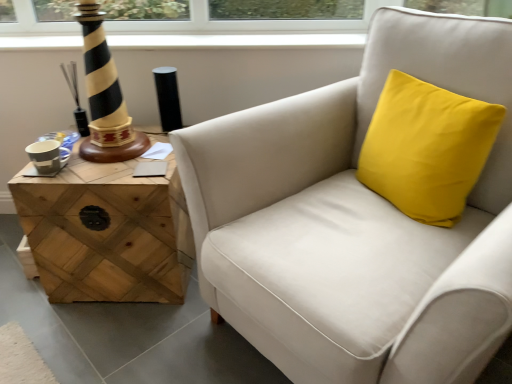
The width and height of the screenshot is (512, 384). Describe the element at coordinates (106, 233) in the screenshot. I see `woodenmaterial/texturetable at left` at that location.

The height and width of the screenshot is (384, 512). In order to click on woodenmaterial/texturetable at left in this screenshot , I will do `click(106, 233)`.

Can matte white armchair at center be found inside woodenmaterial/texturetable at left?

Actually, matte white armchair at center is outside woodenmaterial/texturetable at left.

From the image's perspective, which is below, woodenmaterial/texturetable at left or matte white armchair at center?

woodenmaterial/texturetable at left appears lower in the image.

Is woodenmaterial/texturetable at left looking in the opposite direction of matte white armchair at center?

That's not correct — woodenmaterial/texturetable at left is not looking away from matte white armchair at center.

Considering the positions of objects woodenmaterial/texturetable at left and matte white armchair at center in the image provided, who is more to the right, woodenmaterial/texturetable at left or matte white armchair at center?

matte white armchair at center.

Which object is further away from the camera, yellow fabric cushion at upper right or woodenmaterial/texturetable at left?

Positioned behind is woodenmaterial/texturetable at left.

Does yellow fabric cushion at upper right have a lesser width compared to woodenmaterial/texturetable at left?

Correct, the width of yellow fabric cushion at upper right is less than that of woodenmaterial/texturetable at left.

Could you tell me if yellow fabric cushion at upper right is facing woodenmaterial/texturetable at left?

No, yellow fabric cushion at upper right is not oriented towards woodenmaterial/texturetable at left.

Which object is positioned more to the right, yellow fabric cushion at upper right or woodenmaterial/texturetable at left?

Positioned to the right is yellow fabric cushion at upper right.

Which is in front, point (208, 194) or point (419, 110)?

The point (208, 194) is in front.

Identify the location of chair in front of the yellow fabric cushion at upper right. Image resolution: width=512 pixels, height=384 pixels. (356, 221).

From the image's perspective, which is above, matte white armchair at center or yellow fabric cushion at upper right?

yellow fabric cushion at upper right, from the image's perspective.

From the picture: Based on their positions, is woodenmaterial/texturetable at left located to the left or right of yellow fabric cushion at upper right?

Clearly, woodenmaterial/texturetable at left is on the left of yellow fabric cushion at upper right in the image.

Relative to yellow fabric cushion at upper right, is woodenmaterial/texturetable at left in front or behind?

Clearly, woodenmaterial/texturetable at left is behind yellow fabric cushion at upper right.

Can you tell me how much woodenmaterial/texturetable at left and yellow fabric cushion at upper right differ in facing direction?

The angle between the facing direction of woodenmaterial/texturetable at left and the facing direction of yellow fabric cushion at upper right is 67.4 degrees.

In terms of width, does woodenmaterial/texturetable at left look wider or thinner when compared to yellow fabric cushion at upper right?

Clearly, woodenmaterial/texturetable at left has more width compared to yellow fabric cushion at upper right.

From the image's perspective, relative to matte white armchair at center, is yellow fabric cushion at upper right above or below?

yellow fabric cushion at upper right is situated higher than matte white armchair at center in the image.

Can you confirm if yellow fabric cushion at upper right is smaller than matte white armchair at center?

Indeed, yellow fabric cushion at upper right has a smaller size compared to matte white armchair at center.

Considering the relative positions of yellow fabric cushion at upper right and matte white armchair at center in the image provided, is yellow fabric cushion at upper right to the right of matte white armchair at center from the viewer's perspective?

Indeed, yellow fabric cushion at upper right is positioned on the right side of matte white armchair at center.

Is matte white armchair at center in front of or behind woodenmaterial/texturetable at left in the image?

In the image, matte white armchair at center appears in front of woodenmaterial/texturetable at left.

Does point (388, 62) lie behind point (38, 242)?

No, (388, 62) is in front of (38, 242).

Is matte white armchair at center inside or outside of woodenmaterial/texturetable at left?

matte white armchair at center is not enclosed by woodenmaterial/texturetable at left.

You are a GUI agent. You are given a task and a screenshot of the screen. Output one action in this format:
    pyautogui.click(x=<x>, y=<y>)
    Task: Click on the table behind the matte white armchair at center
    
    Given the screenshot: What is the action you would take?
    pyautogui.click(x=106, y=233)

Find the location of `table below the matte white armchair at center (from the image's perspective)`. table below the matte white armchair at center (from the image's perspective) is located at coordinates (106, 233).

You are a GUI agent. You are given a task and a screenshot of the screen. Output one action in this format:
    pyautogui.click(x=<x>, y=<y>)
    Task: Click on the table lying on the left of yellow fabric cushion at upper right
    The image size is (512, 384).
    Given the screenshot: What is the action you would take?
    pyautogui.click(x=106, y=233)

When comparing their distances from matte white armchair at center, does yellow fabric cushion at upper right or woodenmaterial/texturetable at left seem closer?

yellow fabric cushion at upper right lies closer to matte white armchair at center than the other object.

Looking at the image, which one is located further to matte white armchair at center, woodenmaterial/texturetable at left or yellow fabric cushion at upper right?

Based on the image, woodenmaterial/texturetable at left appears to be further to matte white armchair at center.

When comparing their distances from yellow fabric cushion at upper right, does matte white armchair at center or woodenmaterial/texturetable at left seem further?

woodenmaterial/texturetable at left lies further to yellow fabric cushion at upper right than the other object.

Which object lies nearer to the anchor point woodenmaterial/texturetable at left, matte white armchair at center or yellow fabric cushion at upper right?

matte white armchair at center is closer to woodenmaterial/texturetable at left.

Considering their positions, is yellow fabric cushion at upper right positioned further to woodenmaterial/texturetable at left than matte white armchair at center?

Based on the image, yellow fabric cushion at upper right appears to be further to woodenmaterial/texturetable at left.

Looking at the image, which one is located closer to yellow fabric cushion at upper right, woodenmaterial/texturetable at left or matte white armchair at center?

matte white armchair at center lies closer to yellow fabric cushion at upper right than the other object.

Image resolution: width=512 pixels, height=384 pixels. Identify the location of chair between woodenmaterial/texturetable at left and yellow fabric cushion at upper right in the horizontal direction. (356, 221).